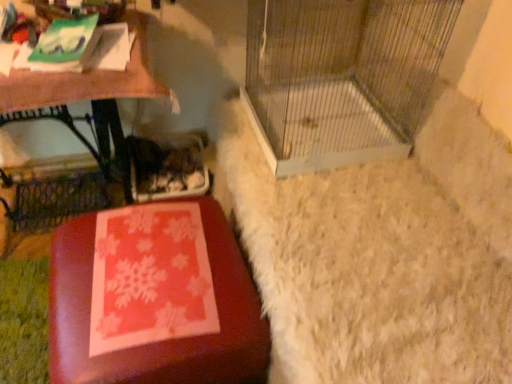
Question: From the image's perspective, is metal wire birdcage at center above or below wooden table at left?

Choices:
 (A) below
 (B) above

Answer: (B)

Question: Choose the correct answer: Is metal wire birdcage at center inside wooden table at left or outside it?

Choices:
 (A) inside
 (B) outside

Answer: (B)

Question: Which of these objects is positioned farthest from the matte red ottoman at lower left?

Choices:
 (A) wooden table at left
 (B) metal wire birdcage at center

Answer: (B)

Question: Which is farther from the matte red ottoman at lower left?

Choices:
 (A) wooden table at left
 (B) metal wire birdcage at center

Answer: (B)